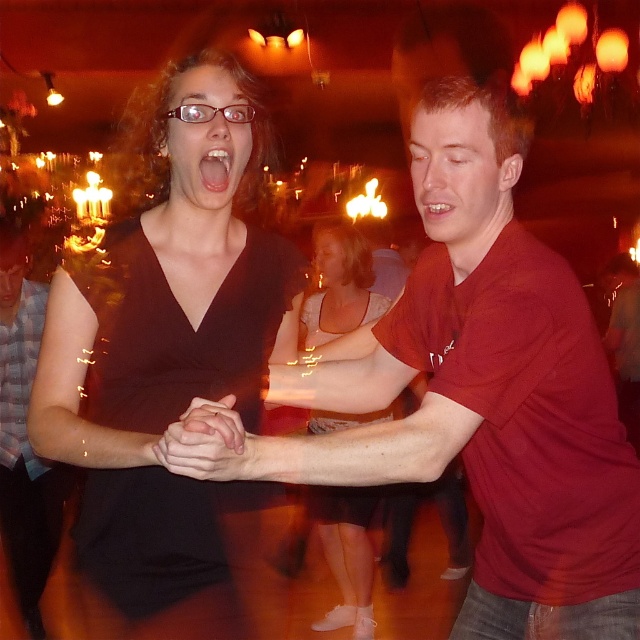
Question: Is black matte dress at center positioned behind matte black dress at center?

Choices:
 (A) yes
 (B) no

Answer: (B)

Question: Can you confirm if matte red t-shirt at center is bigger than black matte dress at center?

Choices:
 (A) yes
 (B) no

Answer: (A)

Question: Is matte red t-shirt at center above black matte dress at center?

Choices:
 (A) no
 (B) yes

Answer: (A)

Question: Which point is closer to the camera taking this photo?

Choices:
 (A) (444, 404)
 (B) (348, 509)

Answer: (A)

Question: Considering the real-world distances, which object is closest to the black matte dress at center?

Choices:
 (A) matte red t-shirt at center
 (B) matte black dress at center

Answer: (A)

Question: Which point appears closest to the camera in this image?

Choices:
 (A) (618, 476)
 (B) (259, 148)

Answer: (A)